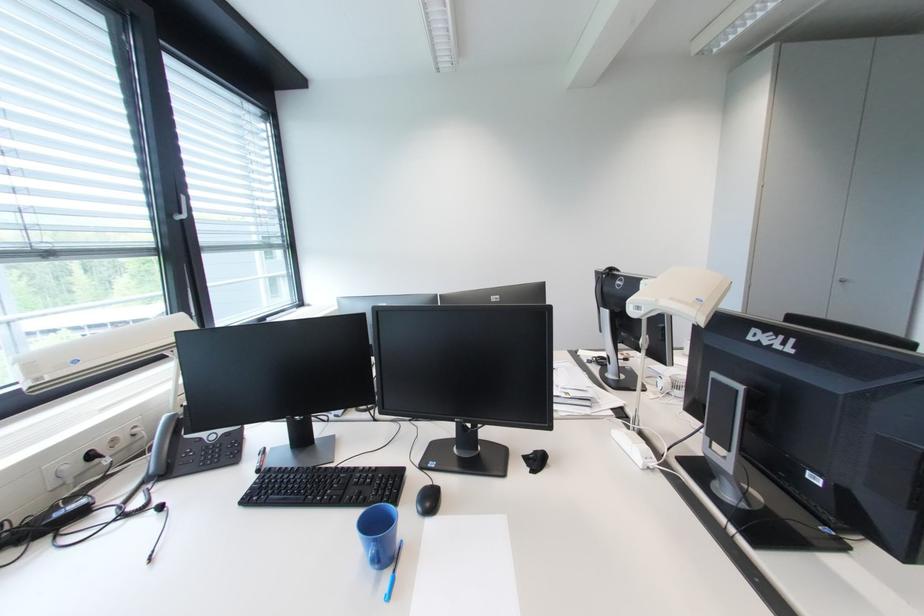
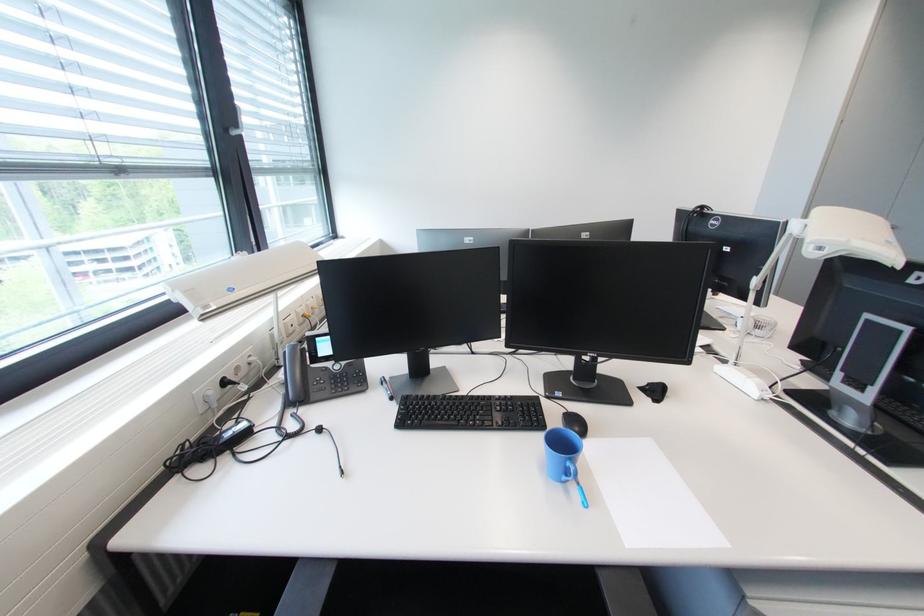
In the second image, find the point that corresponds to (379,546) in the first image.

(575, 464)